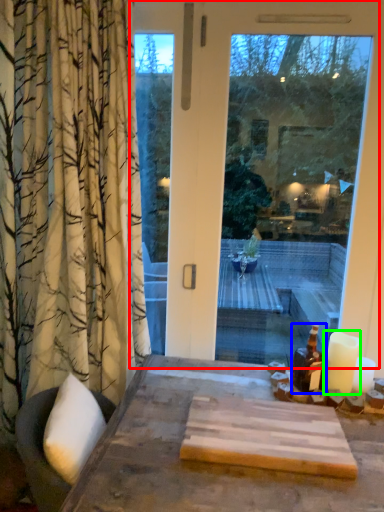
Question: Based on their relative distances, which object is farther from window (highlighted by a red box)? Choose from bottle (highlighted by a blue box) and candle (highlighted by a green box).

Choices:
 (A) bottle
 (B) candle

Answer: (A)